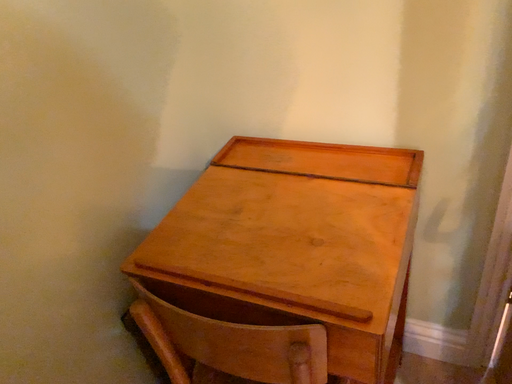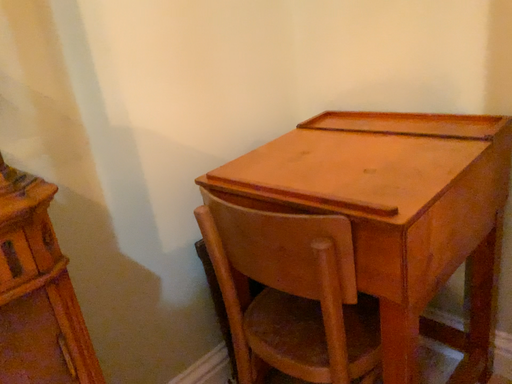
Question: Which way did the camera rotate in the video?

Choices:
 (A) rotated downward
 (B) rotated upward

Answer: (B)